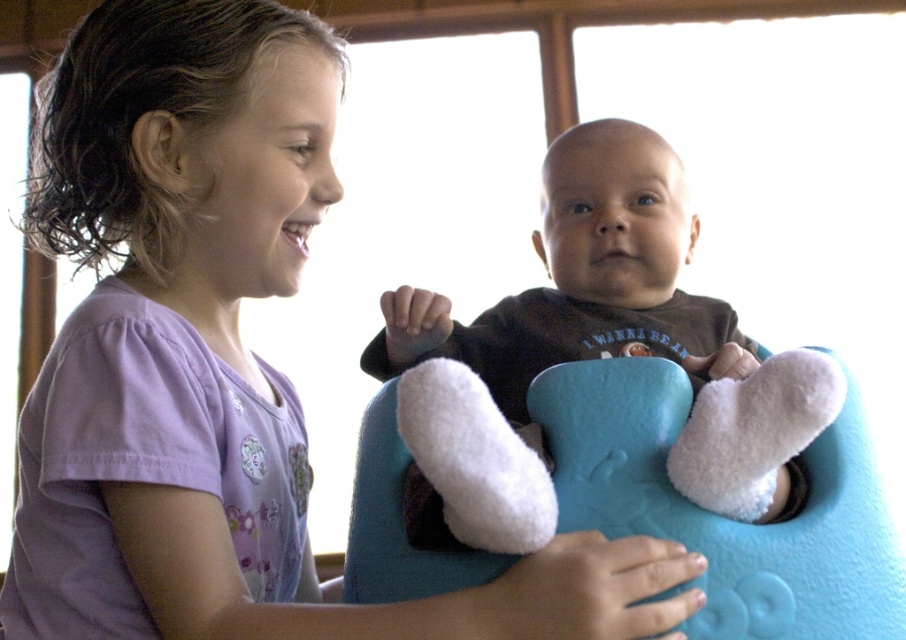
Question: Observing the image, what is the correct spatial positioning of soft brown baby at center in reference to fuzzy blue bib at center?

Choices:
 (A) below
 (B) above

Answer: (B)

Question: Is soft brown baby at center closer to camera compared to fuzzy blue bib at center?

Choices:
 (A) no
 (B) yes

Answer: (B)

Question: Is soft brown baby at center above fuzzy blue bib at center?

Choices:
 (A) no
 (B) yes

Answer: (B)